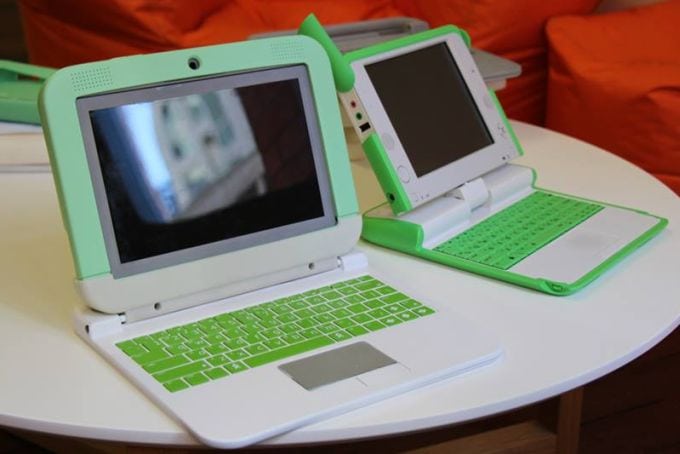
This screenshot has width=680, height=454. I want to click on table leg, so click(x=571, y=419).